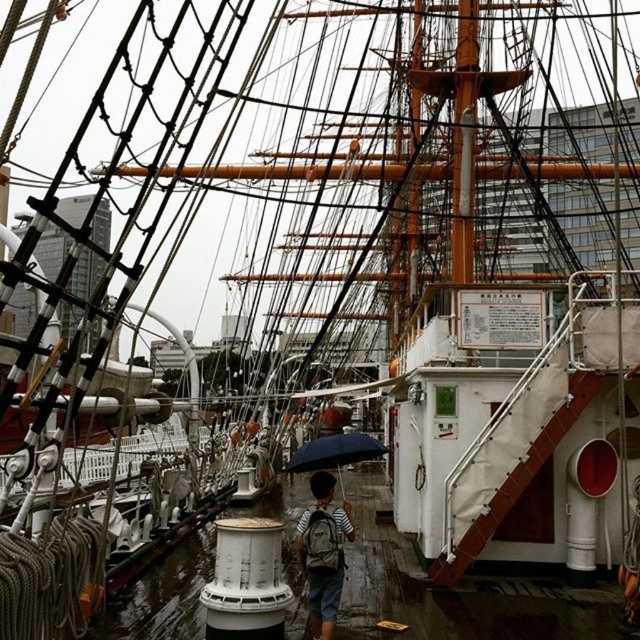
Is striped fabric backpack at center taller than dark blue matte umbrella at center?

No.

Does point (314, 602) come closer to viewer compared to point (365, 456)?

Yes.

At what (x,y) coordinates should I click in order to perform the action: click on striped fabric backpack at center. Please return your answer as a coordinate pair (x, y). The height and width of the screenshot is (640, 640). Looking at the image, I should click on (323, 554).